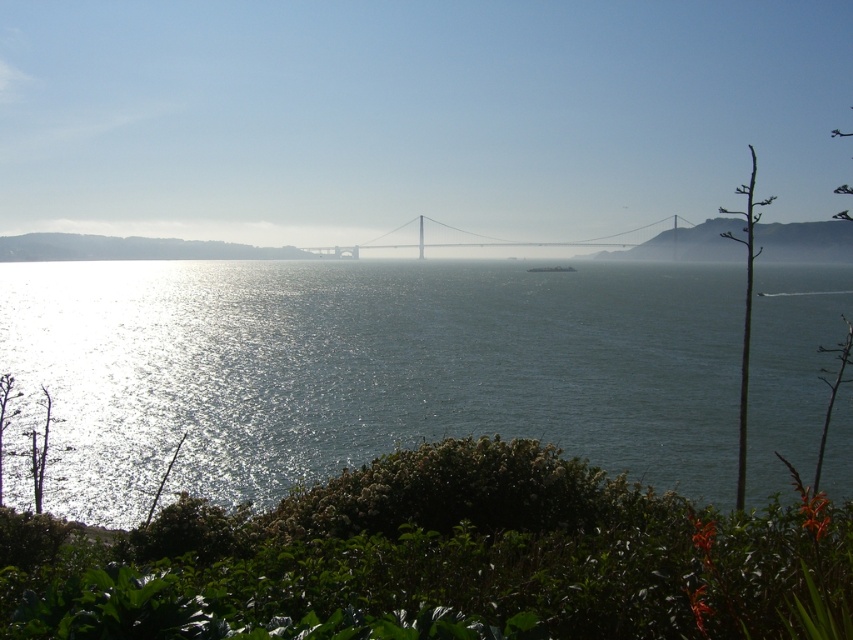
You are a photographer planning to capture the reflection of the metallic golden bridge at center in the glistening water at center. Based on the scene description, can you confirm if the bridge is positioned in a way that its reflection would be visible in the water?

The glistening water at center is positioned under the metallic golden bridge at center, so the reflection of the metallic golden bridge at center should be visible in the glistening water at center.

You are a photographer planning to capture the glistening water at center and the metallic golden bridge at center in a single shot. Based on their sizes in the scene, which one would occupy more of the frame?

The glistening water at center occupies more of the frame because it has a larger size compared to the metallic golden bridge at center.

You are standing at the edge of the scene and want to determine which object is taller between the glistening water at center and the green leafy bush at lower center. Based on the scene, can you identify which one is taller?

The glistening water at center has a greater height compared to the green leafy bush at lower center, so the glistening water at center is taller.